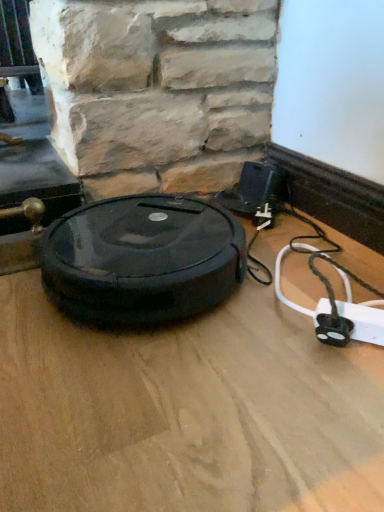
Question: Visually, is white plastic extension cord at lower right positioned to the left or to the right of black rubber robot vacuum cleaner at center?

Choices:
 (A) left
 (B) right

Answer: (B)

Question: Considering the positions of point (360, 320) and point (41, 245), is point (360, 320) closer or farther from the camera than point (41, 245)?

Choices:
 (A) farther
 (B) closer

Answer: (B)

Question: Which is nearer to the white plastic extension cord at lower right?

Choices:
 (A) wooden floor at center
 (B) black rubber robot vacuum cleaner at center

Answer: (A)

Question: Estimate the real-world distances between objects in this image. Which object is farther from the black rubber robot vacuum cleaner at center?

Choices:
 (A) wooden floor at center
 (B) white plastic extension cord at lower right

Answer: (B)